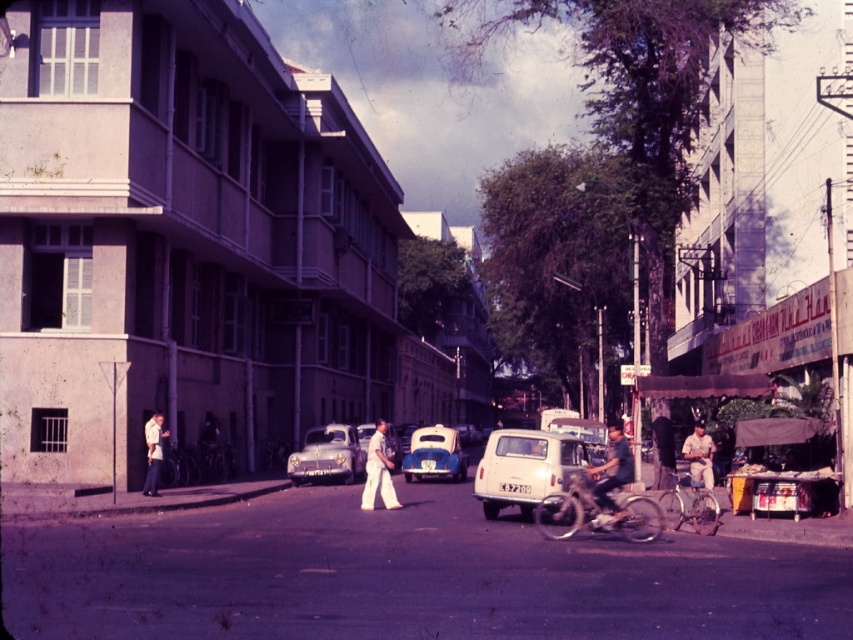
The width and height of the screenshot is (853, 640). Describe the element at coordinates (525, 468) in the screenshot. I see `white matte van at center` at that location.

Does point (548, 460) come behind point (625, 448)?

Yes, point (548, 460) is behind point (625, 448).

The height and width of the screenshot is (640, 853). In order to click on white matte van at center in this screenshot , I will do `click(525, 468)`.

The height and width of the screenshot is (640, 853). Describe the element at coordinates (525, 468) in the screenshot. I see `white matte van at center` at that location.

Who is more distant from viewer, [498,484] or [320,468]?

Point [320,468]

Which is behind, point (572, 470) or point (297, 464)?

The point (297, 464) is behind.

In order to click on white matte van at center in this screenshot , I will do `click(525, 468)`.

This screenshot has height=640, width=853. What are the coordinates of `matte gray car at center` in the screenshot? It's located at (326, 454).

Between point (320, 445) and point (373, 445), which one is positioned in front?

Point (373, 445) is in front.

Between point (323, 474) and point (372, 444), which one is positioned behind?

The point (323, 474) is more distant.

At what (x,y) coordinates should I click in order to perform the action: click on matte gray car at center. Please return your answer as a coordinate pair (x, y). The height and width of the screenshot is (640, 853). Looking at the image, I should click on (326, 454).